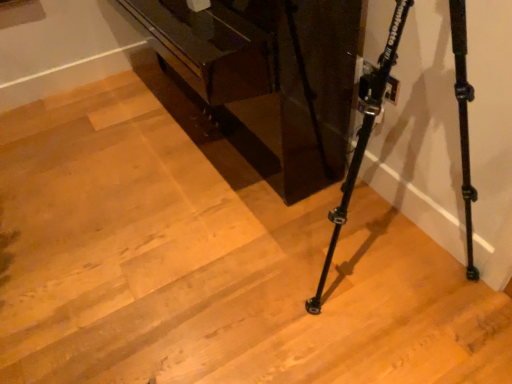
You are a GUI agent. You are given a task and a screenshot of the screen. Output one action in this format:
    pyautogui.click(x=<x>, y=<y>)
    Task: Click on the vacant space in between glossy dark wood piano at center and black matte tripod at lower right
    Image resolution: width=512 pixels, height=384 pixels.
    Given the screenshot: What is the action you would take?
    pyautogui.click(x=264, y=286)